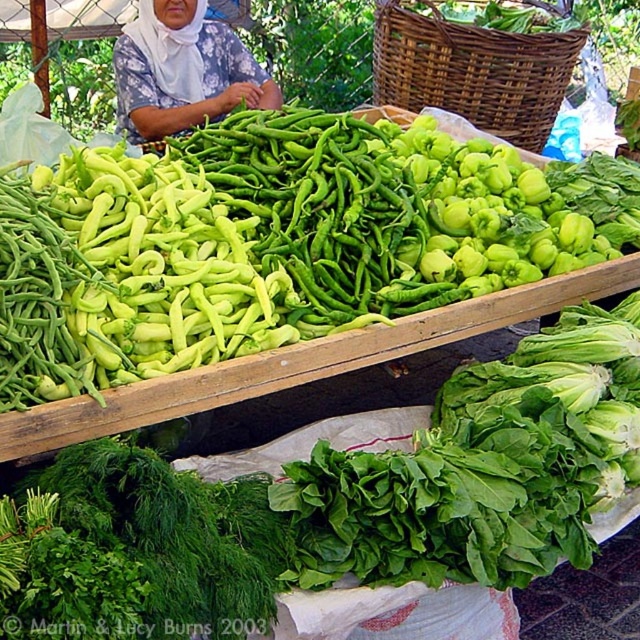
Which is more to the right, green matte peppers at upper left or woven brown basket at upper center?

From the viewer's perspective, woven brown basket at upper center appears more on the right side.

Can you confirm if green matte peppers at upper left is thinner than woven brown basket at upper center?

No.

Is point (129, 372) closer to viewer compared to point (380, 77)?

That is True.

The image size is (640, 640). Find the location of `green matte peppers at upper left`. green matte peppers at upper left is located at coordinates (125, 285).

Is woven brown basket at upper center wider than white cloth headscarf at upper center?

Correct, the width of woven brown basket at upper center exceeds that of white cloth headscarf at upper center.

Can you confirm if woven brown basket at upper center is bigger than white cloth headscarf at upper center?

Yes, woven brown basket at upper center is bigger than white cloth headscarf at upper center.

Is point (528, 96) behind point (152, 40)?

Yes.

The height and width of the screenshot is (640, 640). I want to click on woven brown basket at upper center, so click(472, 70).

From the picture: Who is positioned more to the right, green matte peppers at upper left or white cloth headscarf at upper center?

green matte peppers at upper left

Looking at this image, is green matte peppers at upper left thinner than white cloth headscarf at upper center?

No, green matte peppers at upper left is not thinner than white cloth headscarf at upper center.

Does point (266, 317) come in front of point (211, 86)?

That is True.

The width and height of the screenshot is (640, 640). Identify the location of green matte peppers at upper left. (125, 285).